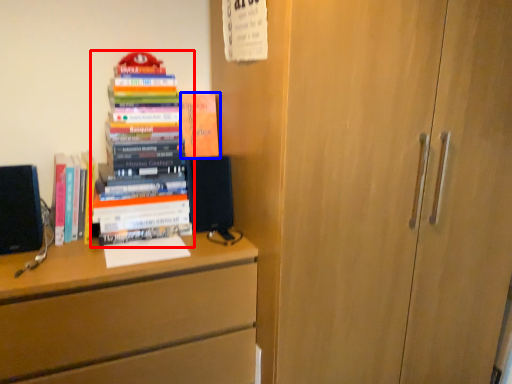
Question: Which object is closer to the camera taking this photo, book (highlighted by a red box) or book (highlighted by a blue box)?

Choices:
 (A) book
 (B) book

Answer: (A)